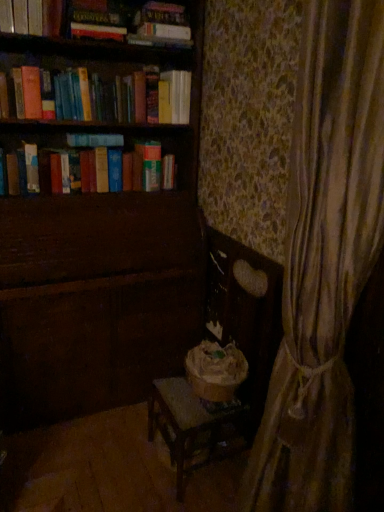
The image size is (384, 512). I want to click on free region on the left part of wooden rocking chair at center, so click(121, 453).